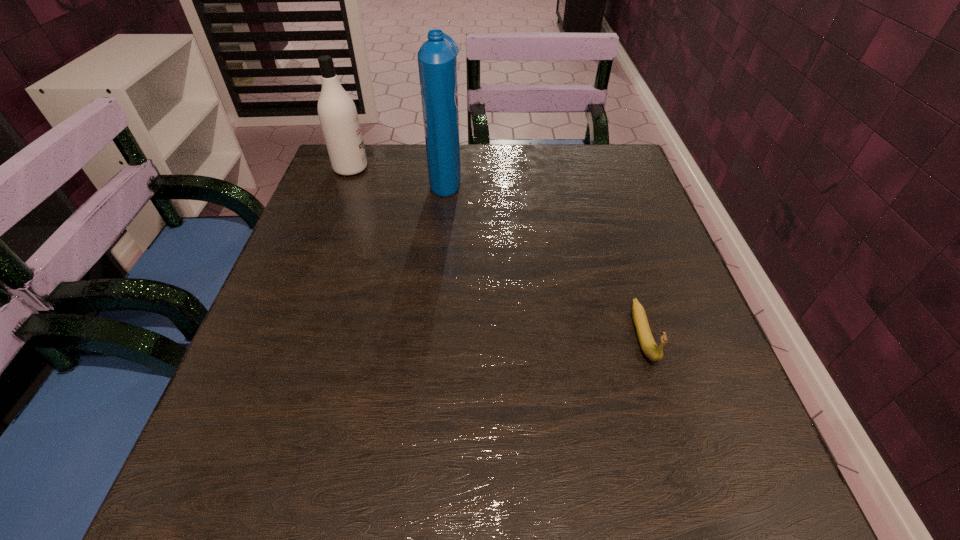
Where is `object located in the right edge section of the desktop`? object located in the right edge section of the desktop is located at coordinates (653, 352).

Identify the location of object present at the far left corner. This screenshot has width=960, height=540. (338, 116).

Where is `blank area at the far edge`? This screenshot has height=540, width=960. blank area at the far edge is located at coordinates pyautogui.click(x=533, y=144).

Identify the location of free spot at the near edge of the desktop. The height and width of the screenshot is (540, 960). (646, 492).

The image size is (960, 540). I want to click on vacant space at the left edge of the desktop, so click(305, 393).

In the image, there is a desktop. Find the location of `vacant space at the right edge`. vacant space at the right edge is located at coordinates (650, 447).

Find the location of a particular element. vacant space at the far left corner of the desktop is located at coordinates (348, 185).

At what (x,y) coordinates should I click in order to perform the action: click on vacant space at the near right corner. Please return your answer as a coordinate pair (x, y). Looking at the image, I should click on (683, 524).

Where is `vacant space that is in between the leftmost object and the banana`? vacant space that is in between the leftmost object and the banana is located at coordinates (496, 252).

Identify the location of vacant area that lies between the nearest object and the second tallest object. (496, 252).